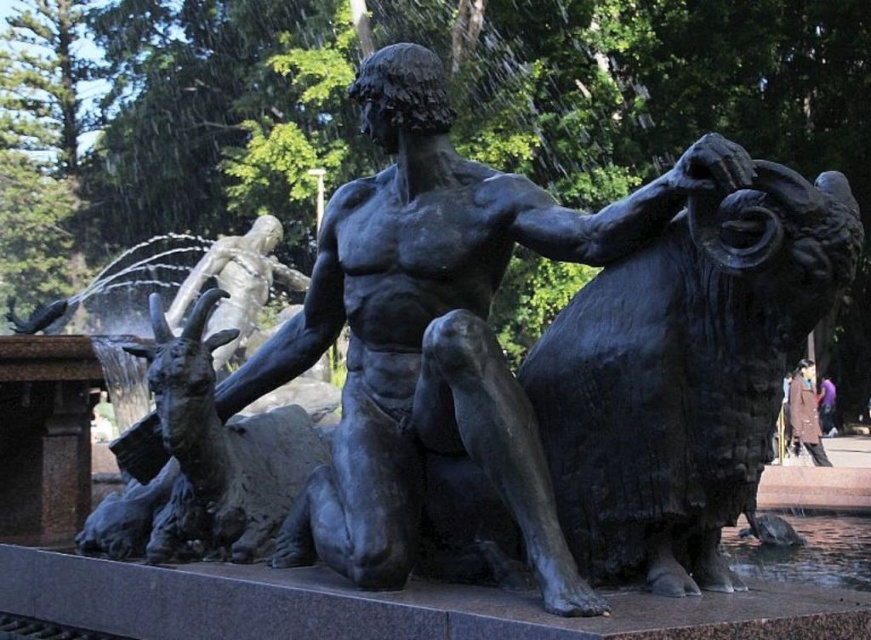
Between bronze muscular figure at center and brown leather jacket at lower right, which one appears on the left side from the viewer's perspective?

bronze muscular figure at center

Can you confirm if bronze muscular figure at center is shorter than brown leather jacket at lower right?

Incorrect, bronze muscular figure at center's height does not fall short of brown leather jacket at lower right's.

Who is more distant from viewer, (352, 195) or (798, 422)?

The point (798, 422) is more distant.

Identify the location of bronze muscular figure at center. (437, 330).